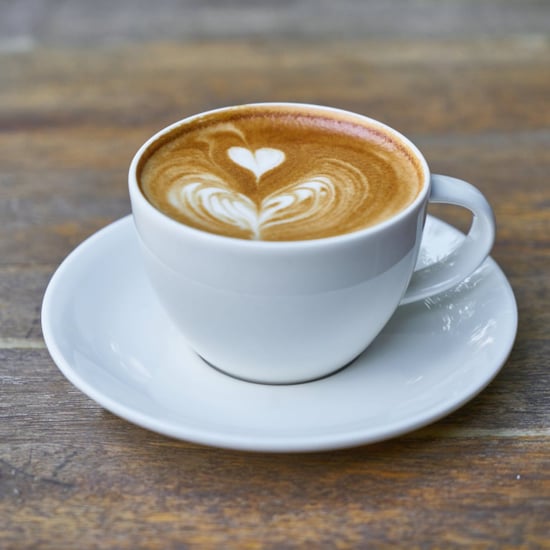
Locate an element on the screen. The width and height of the screenshot is (550, 550). handle is located at coordinates (454, 277).